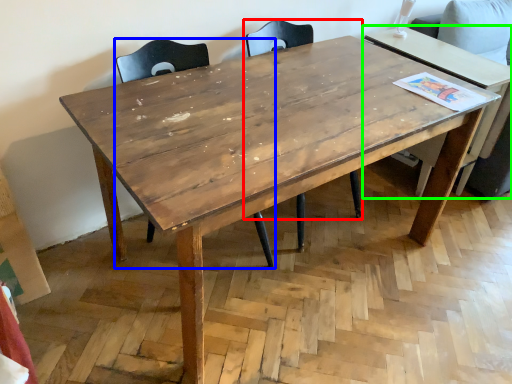
Question: Which is nearer to the chair (highlighted by a red box)? chair (highlighted by a blue box) or table (highlighted by a green box).

Choices:
 (A) chair
 (B) table

Answer: (A)